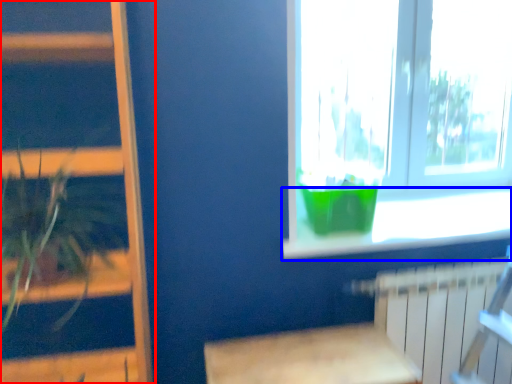
Question: Which object appears farthest to the camera in this image, bookshelf (highlighted by a red box) or window sill (highlighted by a blue box)?

Choices:
 (A) bookshelf
 (B) window sill

Answer: (B)